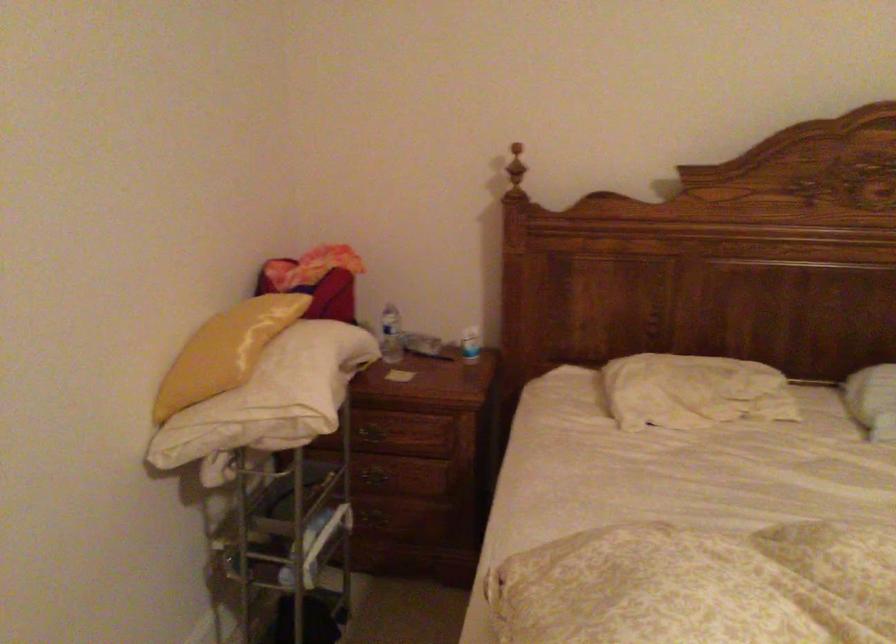
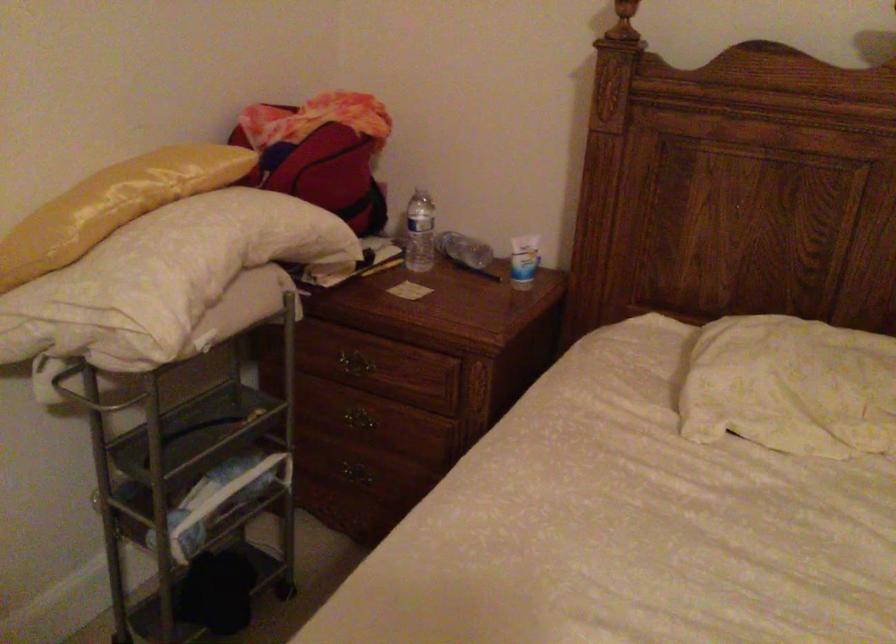
The images are taken continuously from a first-person perspective. In which direction are you moving?

The cameraman walked toward right, forward.